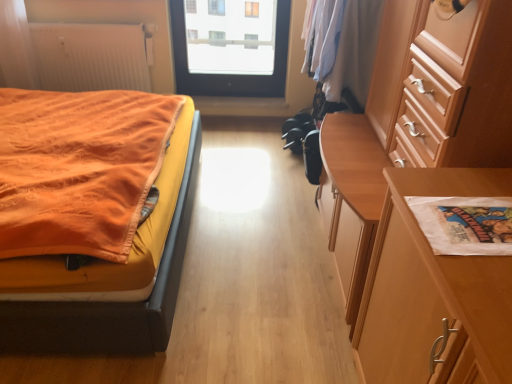
What are the coordinates of `free point above white paper bag at right (from a real-world perspective)` in the screenshot? It's located at (471, 212).